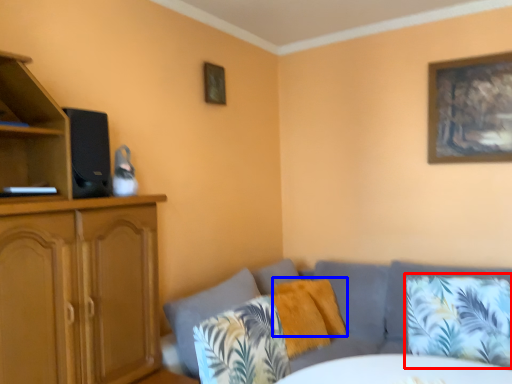
Question: Which point is closer to the camera, pillow (highlighted by a red box) or pillow (highlighted by a blue box)?

Choices:
 (A) pillow
 (B) pillow

Answer: (A)